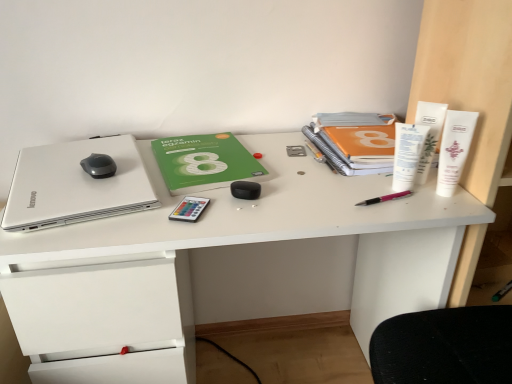
What are the coordinates of `free location to the left of pink metallic pen at center-right, which ranks as the 4th stationery in right-to-left order` in the screenshot? It's located at (304, 196).